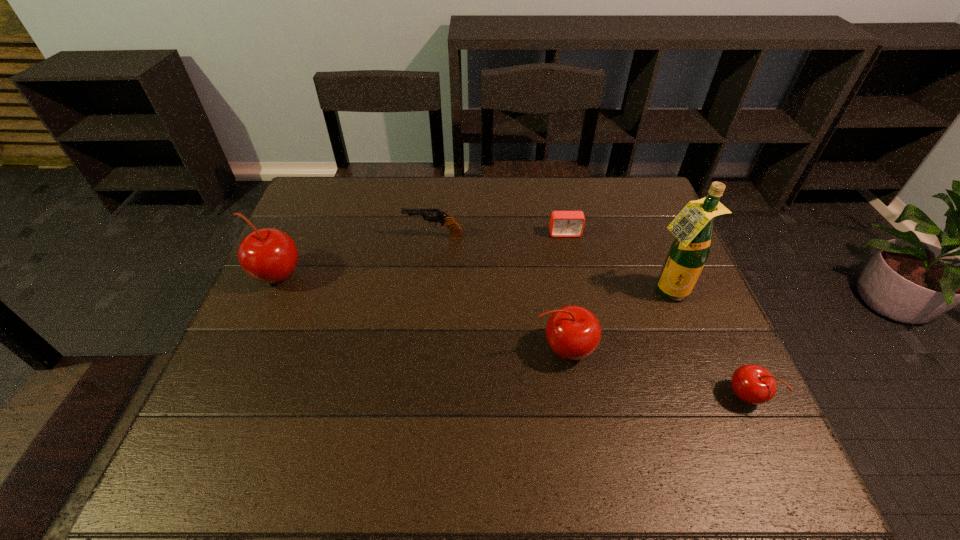
The height and width of the screenshot is (540, 960). What are the coordinates of `vacant region between the second object from left to right and the farthest cherry` in the screenshot? It's located at (355, 256).

The image size is (960, 540). Find the location of `vacant area that lies between the alarm clock and the farthest cherry`. vacant area that lies between the alarm clock and the farthest cherry is located at coordinates (420, 255).

At what (x,y) coordinates should I click in order to perform the action: click on free space between the gun and the leftmost cherry. Please return your answer as a coordinate pair (x, y). This screenshot has width=960, height=540. Looking at the image, I should click on (355, 256).

Find the location of a particular element. vacant area that lies between the shortest cherry and the alarm clock is located at coordinates (655, 315).

Find the location of a particular element. free space that is in between the nearest object and the farthest cherry is located at coordinates (511, 336).

Find the location of `vacant area that lies between the nearest object and the leftmost object`. vacant area that lies between the nearest object and the leftmost object is located at coordinates (511, 336).

Find the location of a particular element. This screenshot has width=960, height=540. free spot between the gun and the shortest object is located at coordinates (499, 235).

The image size is (960, 540). Identify the location of the fourth closest object to the shortest object. (753, 384).

Select which object appears as the fourth closest to the alarm clock. Please provide its 2D coordinates. Your answer should be formatted as a tuple, i.e. [(x, y)], where the tuple contains the x and y coordinates of a point satisfying the conditions above.

[(753, 384)]

You are a GUI agent. You are given a task and a screenshot of the screen. Output one action in this format:
    pyautogui.click(x=<x>, y=<y>)
    Task: Click on the cherry identified as the second closest to the leftmost object
    
    Given the screenshot: What is the action you would take?
    pyautogui.click(x=753, y=384)